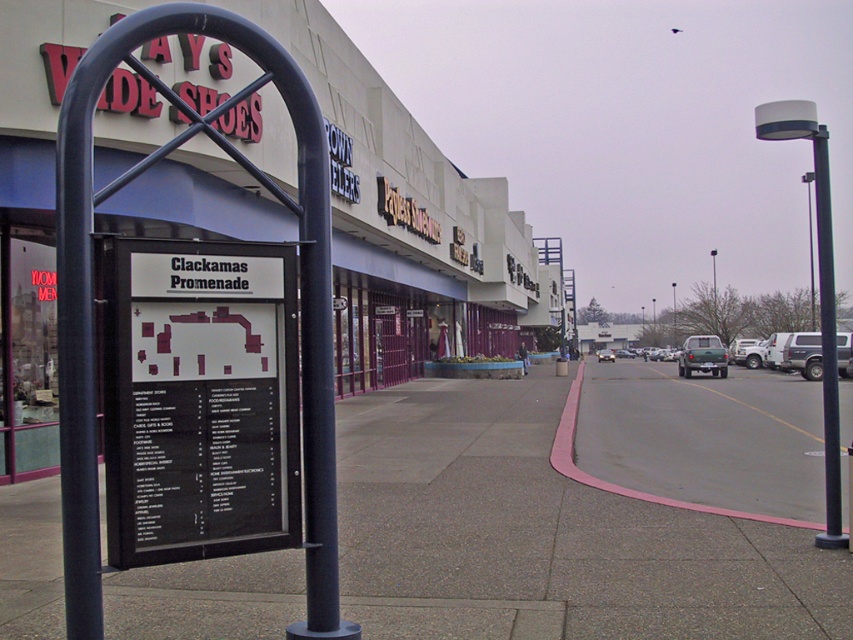
You are standing at the point marked by the coordinates point [200,401] in the image. What object are you standing on?

The point [200,401] is on the black plastic sign at center, so you are standing on the black plastic sign at center.

You are a delivery person trying to park your 3.5 meter wide truck between the black plastic sign at center and the black metal pole at right. Can you safely park your truck there without hitting either object?

The black plastic sign at center and black metal pole at right are 5.84 meters apart from each other. Since the truck is 3.5 meters wide, there is enough space to park between them without hitting either object.